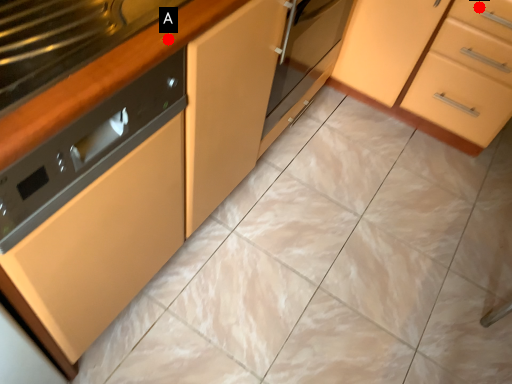
Question: Two points are circled on the image, labeled by A and B beside each circle. Among these points, which one is nearest to the camera?

Choices:
 (A) A is closer
 (B) B is closer

Answer: (A)